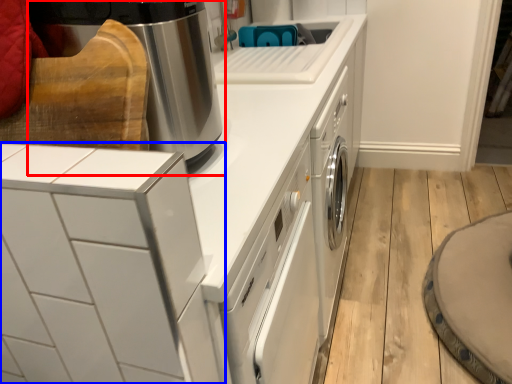
Question: Among these objects, which one is nearest to the camera, home appliance (highlighted by a red box) or home appliance (highlighted by a blue box)?

Choices:
 (A) home appliance
 (B) home appliance

Answer: (B)